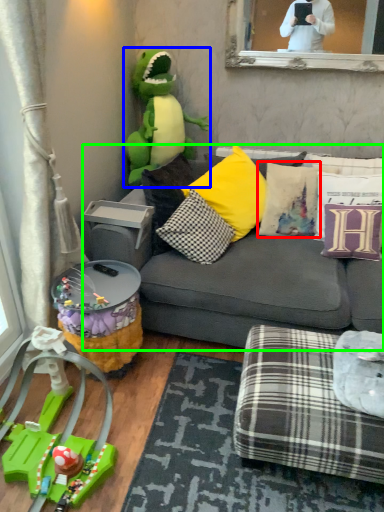
Question: Considering the real-world distances, which object is closest to pillow (highlighted by a red box)? toy (highlighted by a blue box) or studio couch (highlighted by a green box).

Choices:
 (A) toy
 (B) studio couch

Answer: (B)